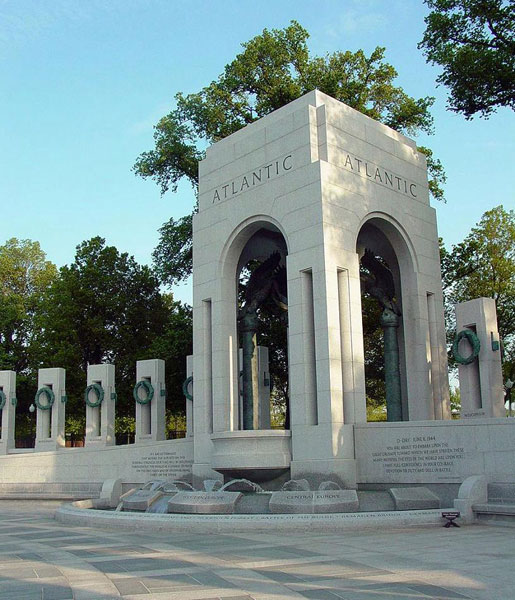
You are a GUI agent. You are given a task and a screenshot of the screen. Output one action in this format:
    pyautogui.click(x=<x>, y=<y>)
    Task: Click on the sunlight on wall
    The width and height of the screenshot is (515, 600).
    Given the screenshot: What is the action you would take?
    pyautogui.click(x=14, y=472)